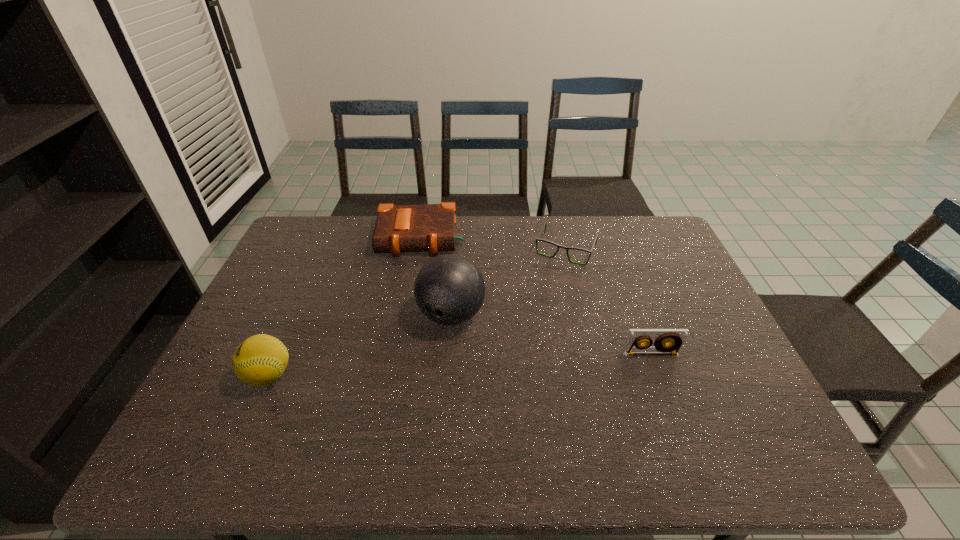
You are a GUI agent. You are given a task and a screenshot of the screen. Output one action in this format:
    pyautogui.click(x=<x>, y=<y>)
    Task: Click on the vacant region between the leftmost object and the videotape
    
    Given the screenshot: What is the action you would take?
    [x=460, y=365]

Identify which object is the third nearest to the Bible. Please provide its 2D coordinates. Your answer should be formatted as a tuple, i.e. [(x, y)], where the tuple contains the x and y coordinates of a point satisfying the conditions above.

[(260, 360)]

In order to click on object that is the third closest to the tallest object in this screenshot , I will do `click(260, 360)`.

This screenshot has height=540, width=960. I want to click on vacant position in the image that satisfies the following two spatial constraints: 1. on the back side of the third nearest object; 2. on the left side of the shortest object, so click(x=456, y=251).